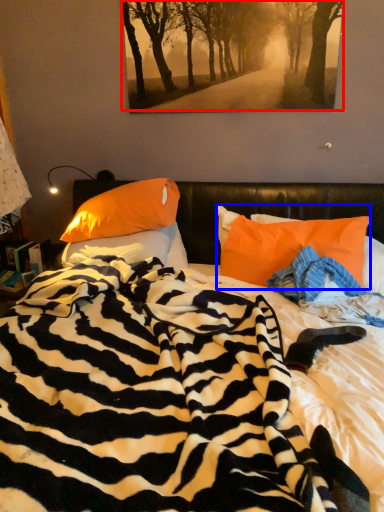
Question: Which object is closer to the camera taking this photo, tree (highlighted by a red box) or pillow (highlighted by a blue box)?

Choices:
 (A) tree
 (B) pillow

Answer: (B)